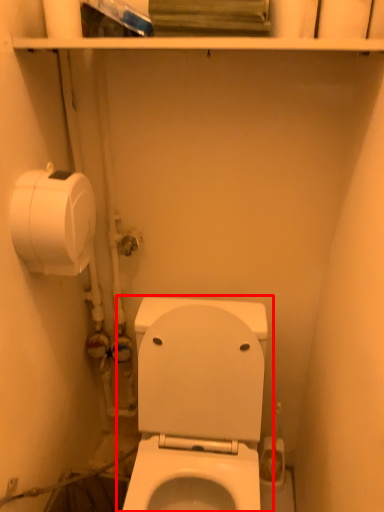
Question: Where is toilet (annotated by the red box) located in relation to toilet paper in the image?

Choices:
 (A) right
 (B) left

Answer: (A)